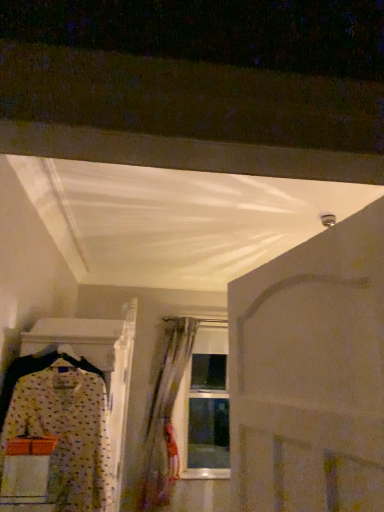
Describe the element at coordinates (66, 433) in the screenshot. I see `polka dot fabric dress at left` at that location.

The height and width of the screenshot is (512, 384). I want to click on polka dot fabric dress at left, so click(66, 433).

Measure the distance between translucent fabric curtain at center and polka dot fabric dress at left.

translucent fabric curtain at center is 2.48 meters away from polka dot fabric dress at left.

Is translucent fabric curtain at center facing towards polka dot fabric dress at left?

Yes, translucent fabric curtain at center is facing polka dot fabric dress at left.

Based on the photo, does translucent fabric curtain at center contain polka dot fabric dress at left?

No, polka dot fabric dress at left is not inside translucent fabric curtain at center.

Is translucent fabric curtain at center with polka dot fabric dress at left?

No, translucent fabric curtain at center is not with polka dot fabric dress at left.

Which of these two, polka dot fabric dress at left or translucent fabric curtain at center, is thinner?

With smaller width is polka dot fabric dress at left.

Does point (103, 482) come in front of point (174, 349)?

That is True.

Which of these two, polka dot fabric dress at left or translucent fabric curtain at center, is bigger?

translucent fabric curtain at center is bigger.

From the image's perspective, between polka dot fabric dress at left and translucent fabric curtain at center, who is located below?

translucent fabric curtain at center, from the image's perspective.

Visually, is white matte door at center positioned to the left or to the right of polka dot fabric dress at left?

white matte door at center is to the right of polka dot fabric dress at left.

Would you say polka dot fabric dress at left is part of white matte door at center's contents?

Actually, polka dot fabric dress at left is outside white matte door at center.

Can you confirm if white matte door at center is thinner than polka dot fabric dress at left?

Correct, the width of white matte door at center is less than that of polka dot fabric dress at left.

Is translucent fabric curtain at center bigger than white matte door at center?

Yes.

Considering the relative positions of translucent fabric curtain at center and white matte door at center in the image provided, is translucent fabric curtain at center to the left of white matte door at center from the viewer's perspective?

Yes, translucent fabric curtain at center is to the left of white matte door at center.

Would you consider translucent fabric curtain at center to be distant from white matte door at center?

translucent fabric curtain at center is positioned a significant distance from white matte door at center.

Considering the sizes of objects polka dot fabric dress at left and white matte door at center in the image provided, who is shorter, polka dot fabric dress at left or white matte door at center?

Standing shorter between the two is white matte door at center.

Is polka dot fabric dress at left behind white matte door at center?

Yes, it is.

Which point is more forward, (x=54, y=377) or (x=375, y=204)?

The point (x=375, y=204) is closer.

Can you confirm if white matte door at center is shorter than translucent fabric curtain at center?

Yes.

From the image's perspective, which is below, white matte door at center or translucent fabric curtain at center?

translucent fabric curtain at center is shown below in the image.

Can you see white matte door at center touching translucent fabric curtain at center?

No, white matte door at center is not with translucent fabric curtain at center.

Does white matte door at center turn towards translucent fabric curtain at center?

No, white matte door at center is not oriented towards translucent fabric curtain at center.

Locate an element on the screen. This screenshot has height=512, width=384. curtain on the right of polka dot fabric dress at left is located at coordinates (165, 419).

Where is `curtain below the polka dot fabric dress at left (from the image's perspective)`? curtain below the polka dot fabric dress at left (from the image's perspective) is located at coordinates (165, 419).

Looking at the image, which one is located further to white matte door at center, translucent fabric curtain at center or polka dot fabric dress at left?

Based on the image, translucent fabric curtain at center appears to be further to white matte door at center.

Consider the image. Estimate the real-world distances between objects in this image. Which object is further from white matte door at center, polka dot fabric dress at left or translucent fabric curtain at center?

translucent fabric curtain at center.

Estimate the real-world distances between objects in this image. Which object is further from translucent fabric curtain at center, white matte door at center or polka dot fabric dress at left?

white matte door at center is further to translucent fabric curtain at center.

Consider the image. Based on their spatial positions, is translucent fabric curtain at center or white matte door at center further from polka dot fabric dress at left?

translucent fabric curtain at center is further to polka dot fabric dress at left.

Based on their spatial positions, is polka dot fabric dress at left or white matte door at center further from translucent fabric curtain at center?

The object further to translucent fabric curtain at center is white matte door at center.

Based on their spatial positions, is white matte door at center or translucent fabric curtain at center closer to polka dot fabric dress at left?

Among the two, white matte door at center is located nearer to polka dot fabric dress at left.

The image size is (384, 512). I want to click on fancy dress between white matte door at center and translucent fabric curtain at center from front to back, so click(x=66, y=433).